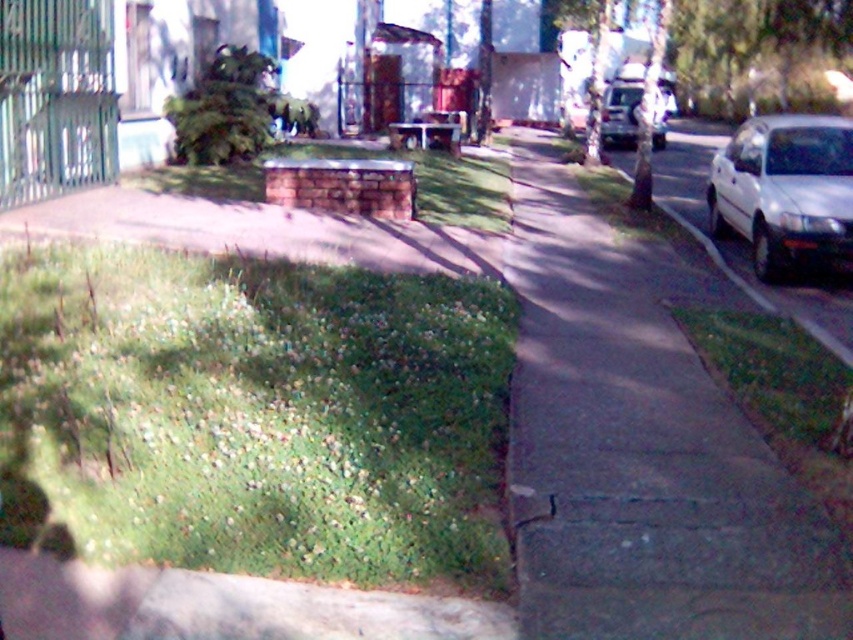
You are a gardener who needs to mow the lawn. You have a lawnmower that can only handle areas wider than 1 meter. Looking at the image, can you determine if the green leafy grass at lower left and the green grass at lower right are both wide enough for your lawnmower to handle?

The green leafy grass at lower left has a width larger than 1 meter since its width is larger than the green grass at lower right. However, the width of the green grass at lower right is unknown. Therefore, only the green leafy grass at lower left is confirmed to be wide enough for the lawnmower.

You are a gardener looking to water plants in the suburban street scene. You see the green grass at lower right and the green leafy tree at upper center. Which object is located below the other?

The green grass at lower right is positioned under the green leafy tree at upper center, meaning the grass is below the tree.

You are a delivery person trying to park your white matte car at right in a spot next to the green leafy tree at upper center. Considering the height of the car and the tree, will the car fit under the tree without hitting its branches?

The white matte car at right is taller than the green leafy tree at upper center, so parking under the tree may result in the car hitting the branches since the car is taller than the tree.